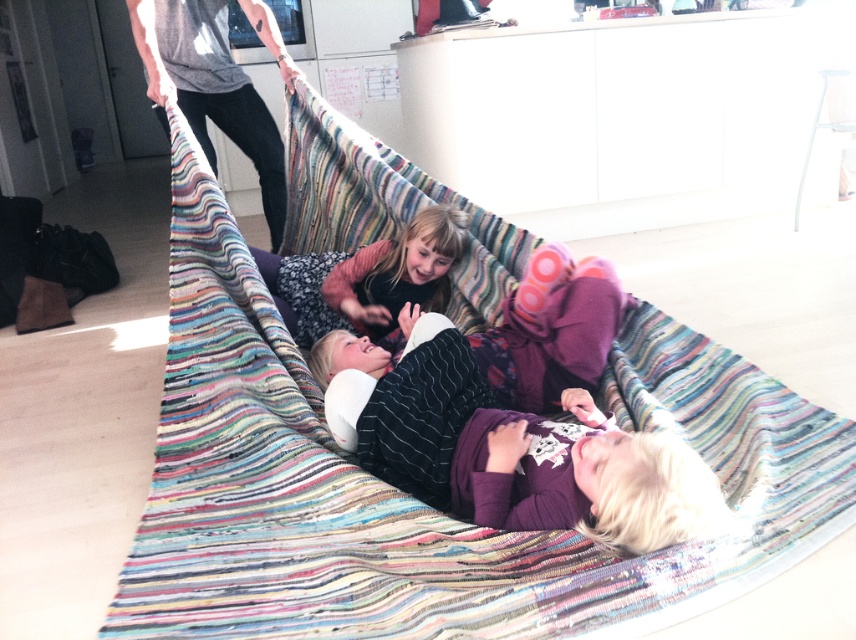
Question: Does purple soft fabric at center have a lesser width compared to matte black shirt at center?

Choices:
 (A) no
 (B) yes

Answer: (A)

Question: Is purple soft fabric at center to the right of matte black shirt at center from the viewer's perspective?

Choices:
 (A) yes
 (B) no

Answer: (A)

Question: Is purple soft fabric at center to the right of matte black shirt at center from the viewer's perspective?

Choices:
 (A) yes
 (B) no

Answer: (A)